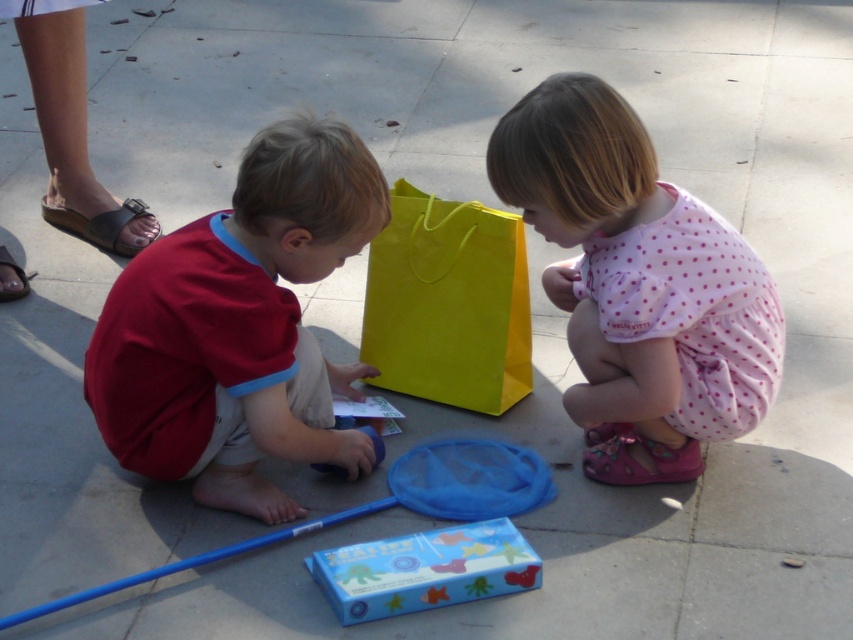
Between point (735, 308) and point (508, 554), which one is positioned behind?

Point (735, 308)

Is pink dotted fabric at lower right further to the viewer compared to blue cardboard box at center?

No, pink dotted fabric at lower right is in front of blue cardboard box at center.

Is point (581, 365) behind point (392, 557)?

Yes, it is.

I want to click on pink dotted fabric at lower right, so click(x=637, y=285).

Between matte red shirt at left and yellow paper bag at center, which one is positioned higher?

yellow paper bag at center

Does point (202, 467) come in front of point (474, 212)?

Yes, point (202, 467) is in front of point (474, 212).

The height and width of the screenshot is (640, 853). I want to click on matte red shirt at left, so click(239, 326).

Can you confirm if yellow paper bag at center is bigger than blue cardboard box at center?

Yes.

Does yellow paper bag at center have a lesser width compared to blue cardboard box at center?

Yes, yellow paper bag at center is thinner than blue cardboard box at center.

The height and width of the screenshot is (640, 853). Identify the location of yellow paper bag at center. (448, 304).

Identify the location of yellow paper bag at center. This screenshot has width=853, height=640. (448, 304).